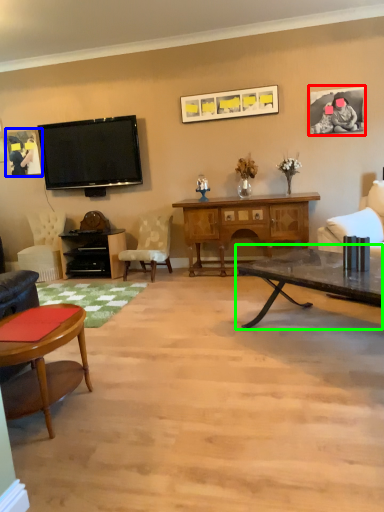
Question: Estimate the real-world distances between objects in this image. Which object is closer to picture frame (highlighted by a red box), picture frame (highlighted by a blue box) or coffee table (highlighted by a green box)?

Choices:
 (A) picture frame
 (B) coffee table

Answer: (B)